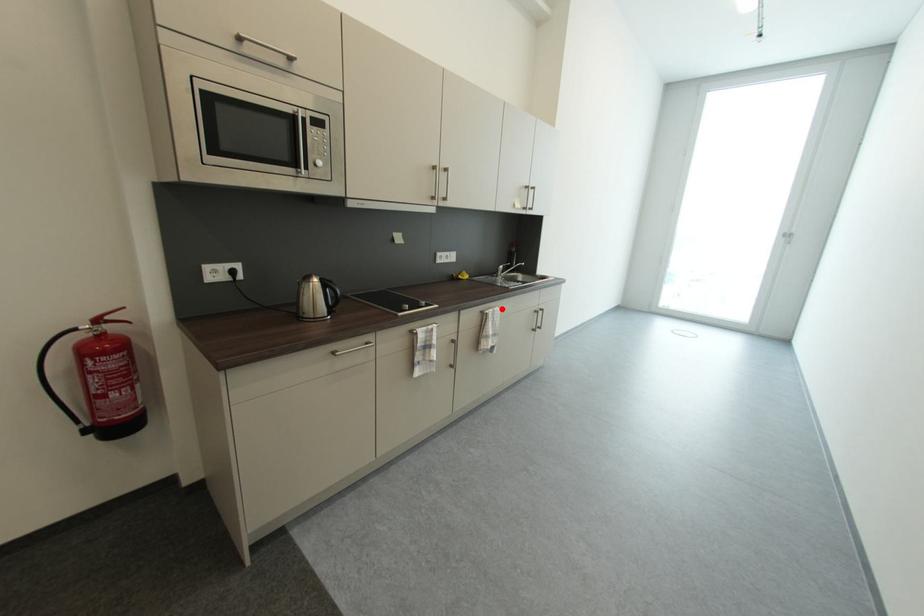
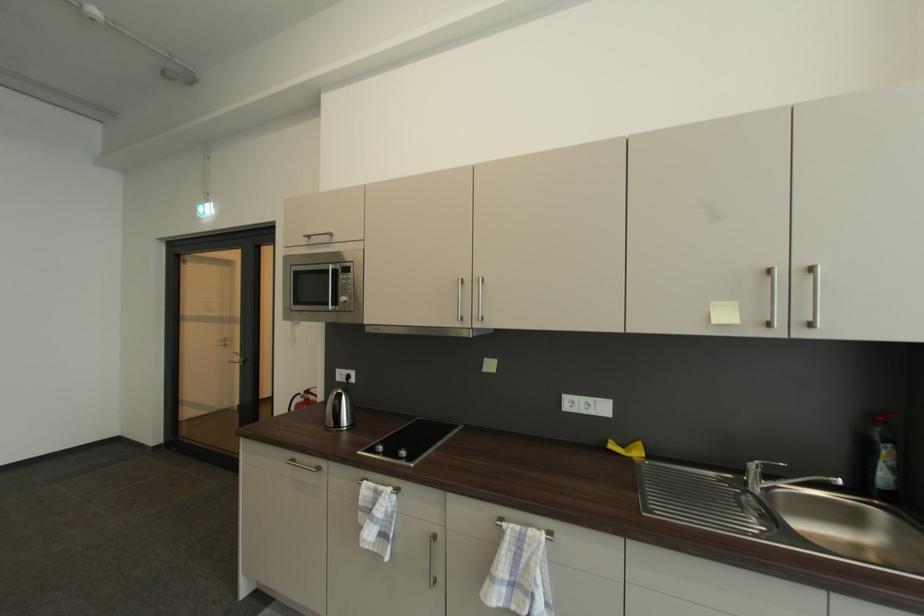
In the second image, find the point that corresponds to the highlighted location in the first image.

(545, 531)